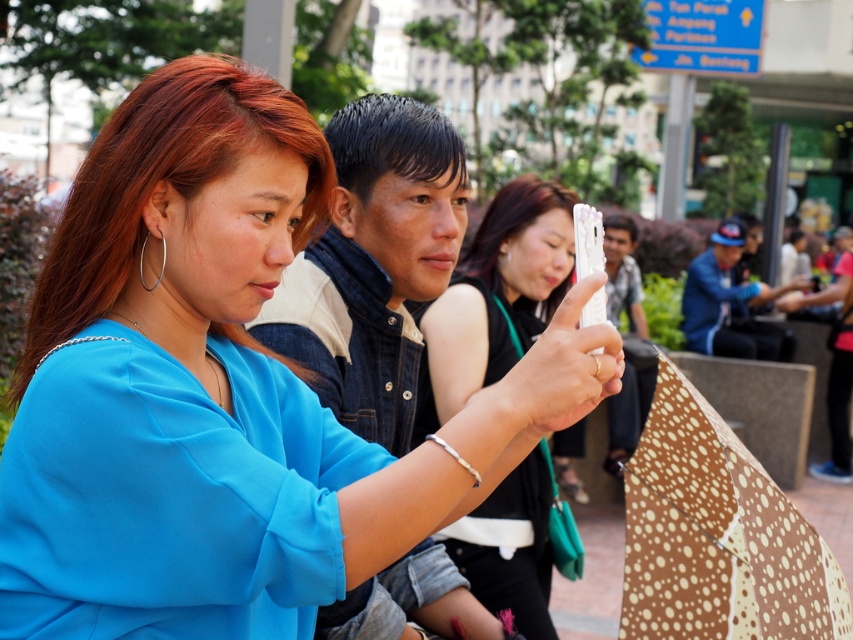
You are a photographer trying to capture the matte blue blouse at center and the white matte phone at center in a single shot. Based on their positions, which object should you focus on first to ensure both are in focus?

The matte blue blouse at center is closer to the viewer than the white matte phone at center. To ensure both are in focus, you should focus on the matte blue blouse at center first, as it is the closer object.

From the picture: You are a fashion designer observing a model wearing a matte blue blouse at center and holding a white matte phone at center. Which item is taller between the two?

The white matte phone at center is taller than the matte blue blouse at center.